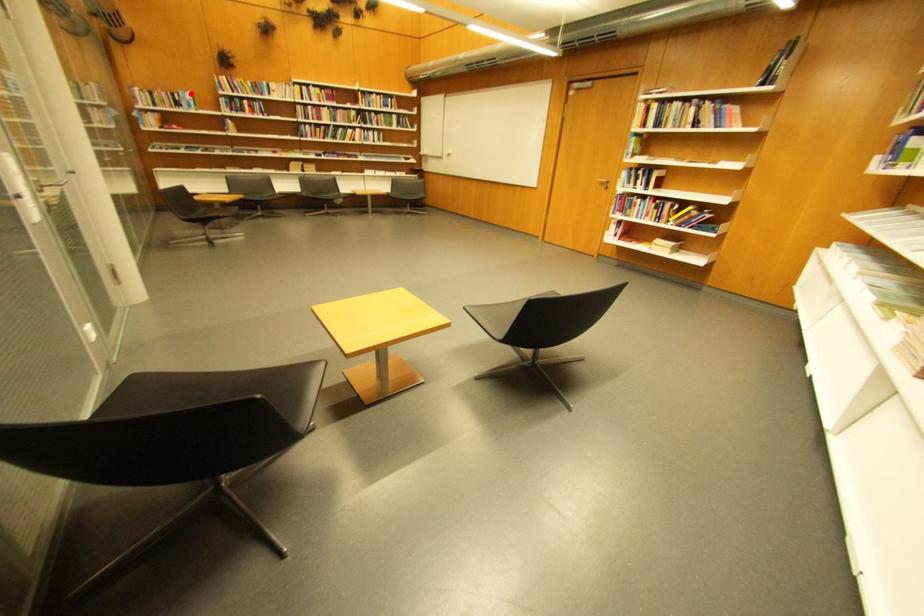
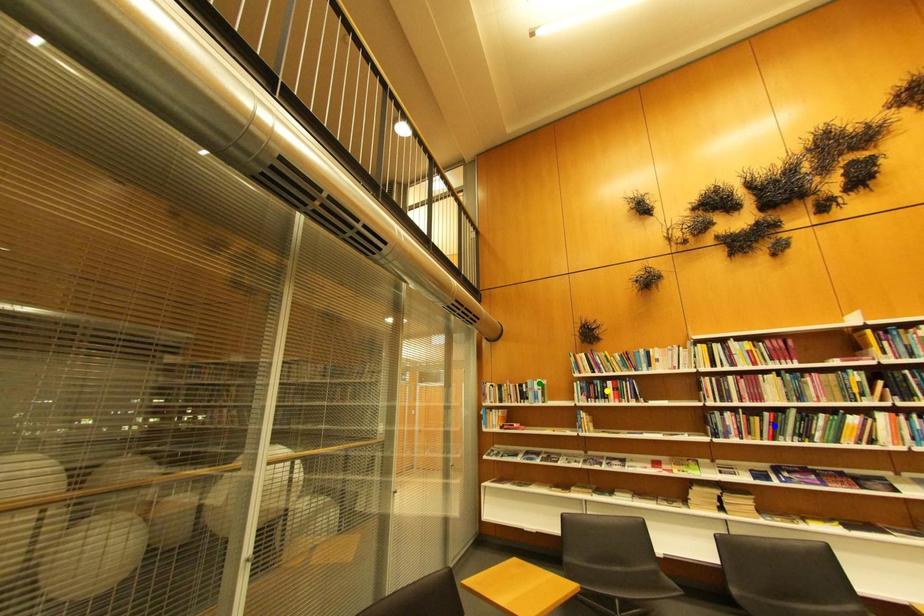
Question: I am providing you with two images of the same scene from different viewpoints. A red point is marked on the first image. You are given multiple points on the second image. Which point in image 2 represents the same 3d spot as the red point in image 1?

Choices:
 (A) blue point
 (B) yellow point
 (C) green point

Answer: (C)